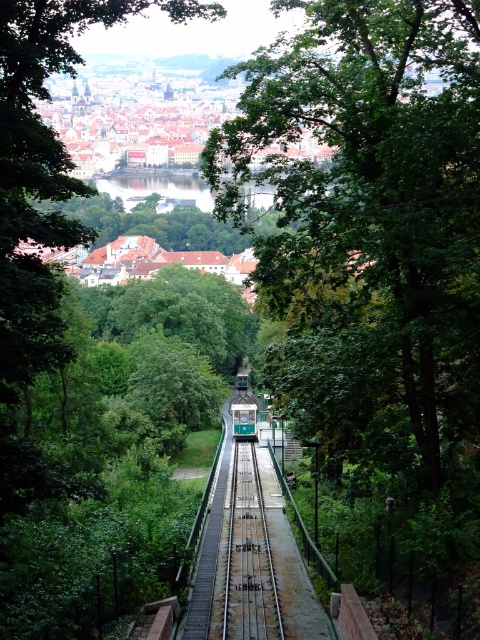
Question: Which point is closer to the camera taking this photo?

Choices:
 (A) (48, 296)
 (B) (232, 401)
 (C) (441, 484)
 (D) (254, 458)

Answer: (A)

Question: Can you confirm if green leafy tree at center is thinner than green leafy tree at upper center?

Choices:
 (A) no
 (B) yes

Answer: (B)

Question: Is green leafy tree at center smaller than green leafy tree at upper center?

Choices:
 (A) yes
 (B) no

Answer: (B)

Question: Is green leafy tree at center above green leafy tree at upper center?

Choices:
 (A) yes
 (B) no

Answer: (A)

Question: Considering the real-world distances, which object is farthest from the green matte train at center?

Choices:
 (A) green leafy tree at center
 (B) green leafy tree at upper center
 (C) green metallic train track at center

Answer: (A)

Question: Among these points, which one is nearest to the camera?

Choices:
 (A) (245, 410)
 (B) (10, 129)

Answer: (B)